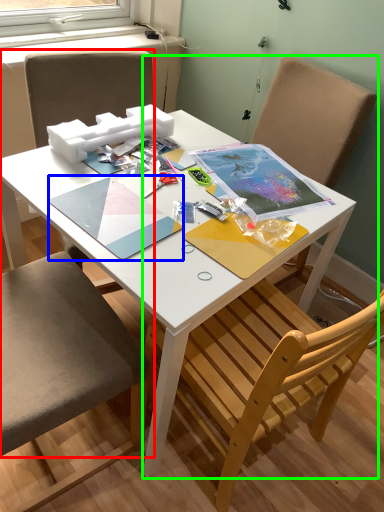
Question: Based on their relative distances, which object is nearer to chair (highlighted by a red box)? Choose from notebook (highlighted by a blue box) and chair (highlighted by a green box).

Choices:
 (A) notebook
 (B) chair

Answer: (A)